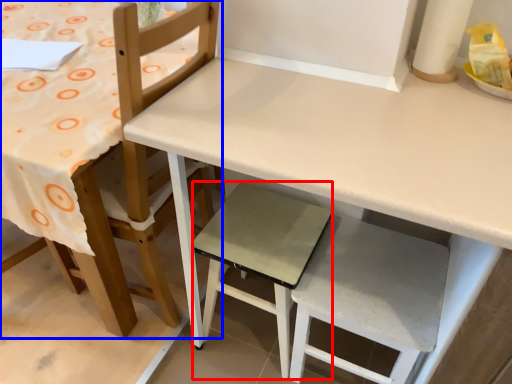
Question: Which object is closer to the camera taking this photo, step stool (highlighted by a red box) or chair (highlighted by a blue box)?

Choices:
 (A) step stool
 (B) chair

Answer: (B)